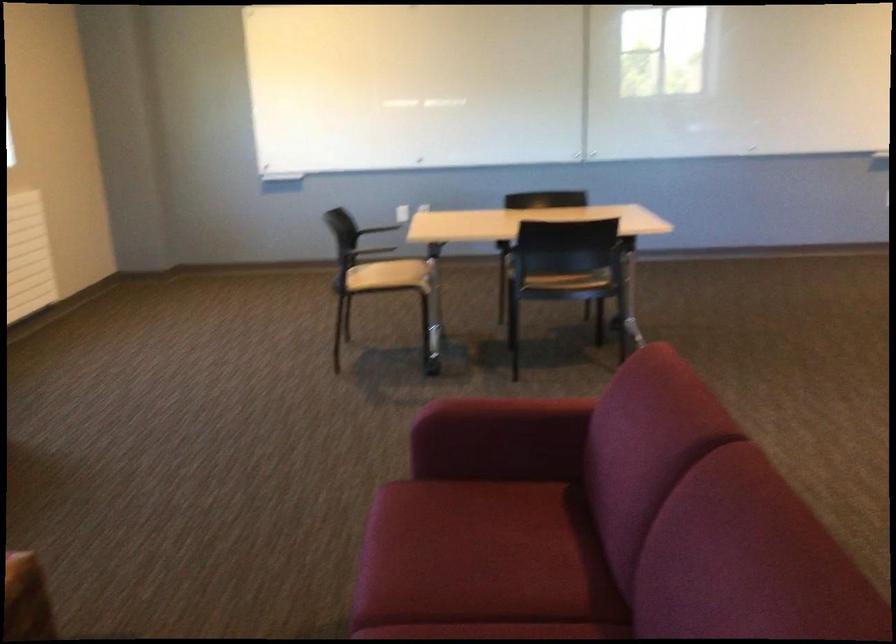
What do you see at coordinates (479, 556) in the screenshot? I see `the red sofa sitting surface` at bounding box center [479, 556].